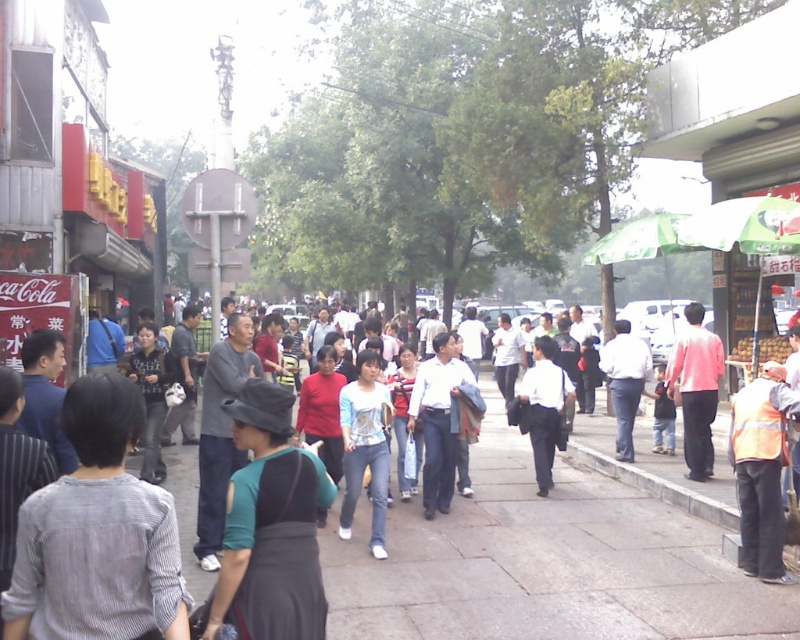
You are a photographer standing in the middle of the bustling street scene. You notice two people wearing a striped fabric shirt at center and a white shirt at center. Which person is wearing a shorter shirt?

The striped fabric shirt at center is shorter than the white shirt at center, so the person wearing the striped fabric shirt at center has a shorter shirt.